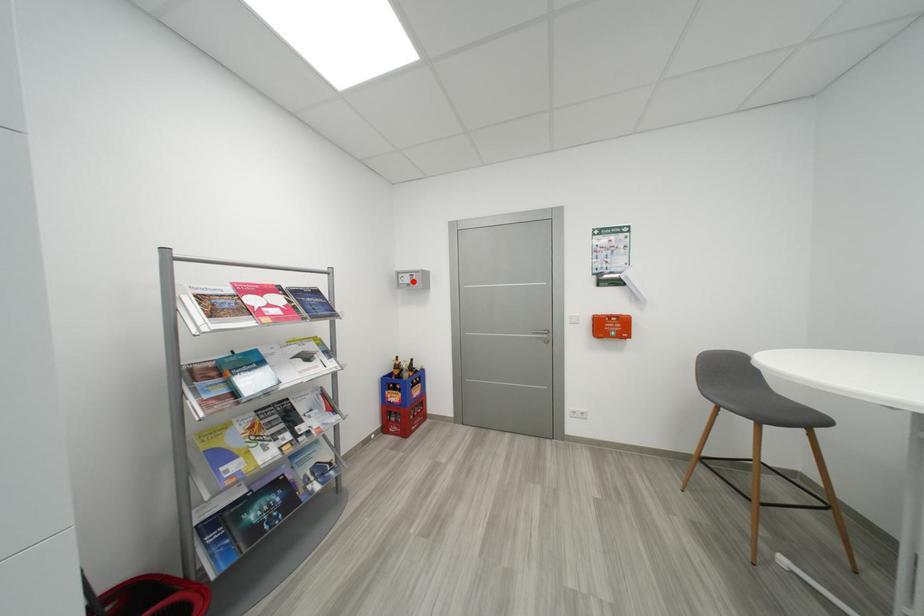
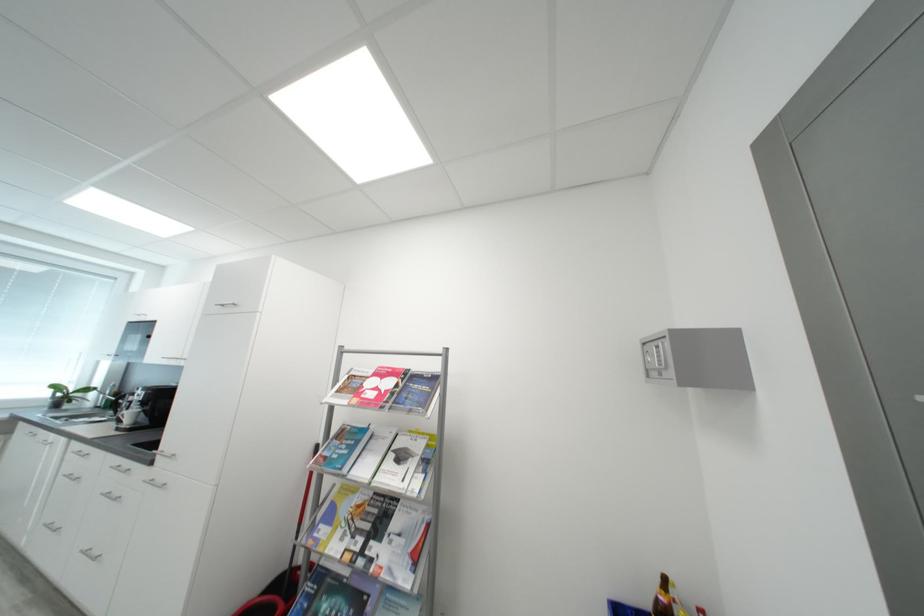
In the second image, find the point that corresponds to the highlighted location in the first image.

(660, 361)